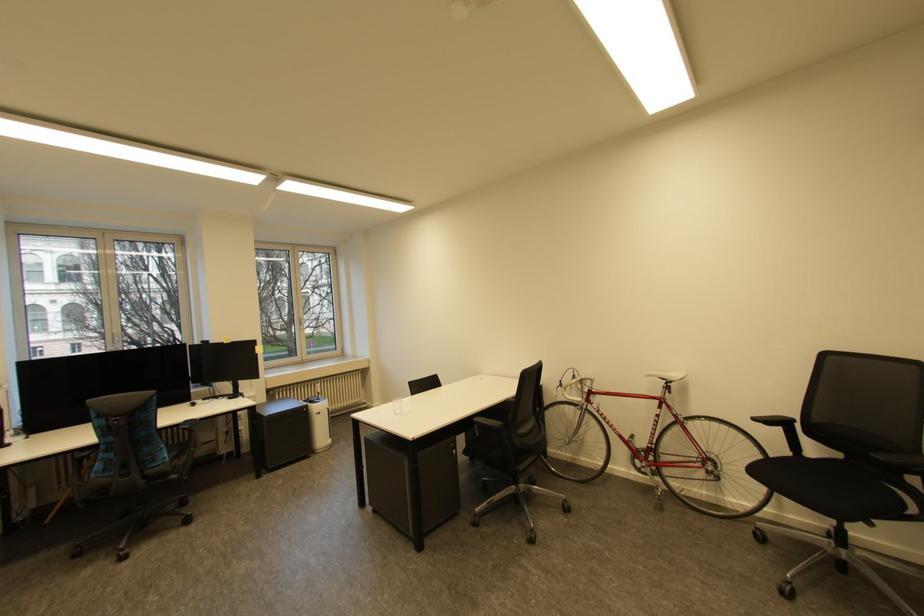
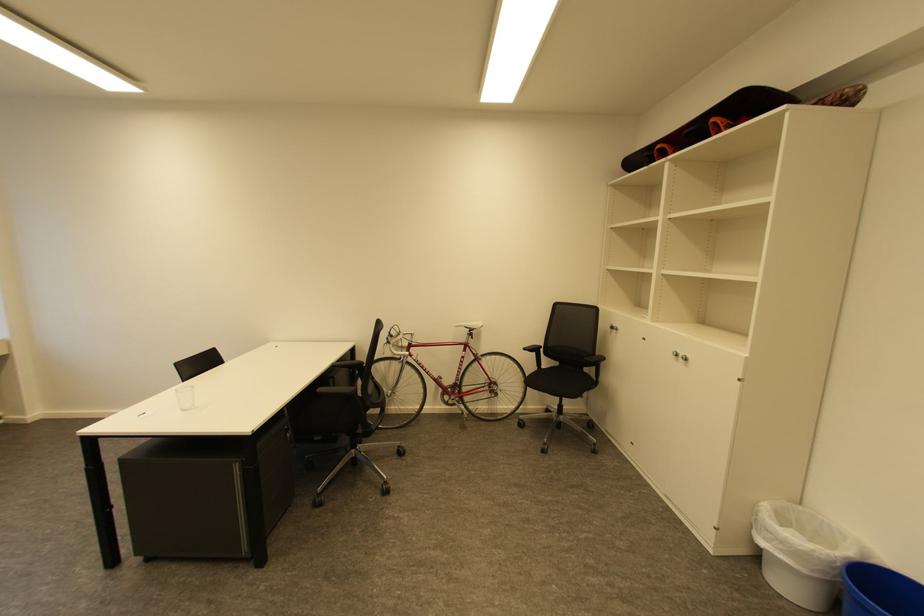
Find the pixel in the second image that matches (761,419) in the first image.

(531, 350)